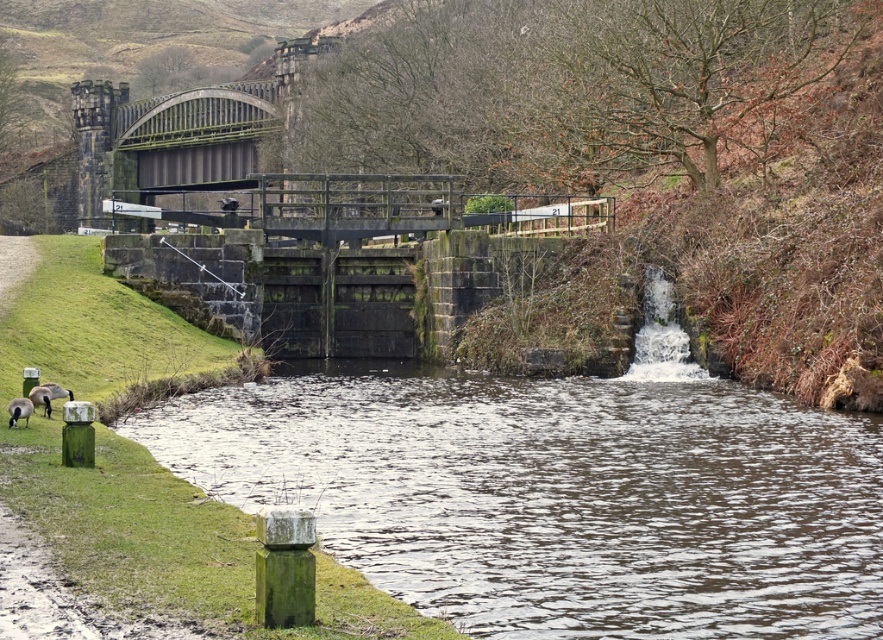
Question: Is brown/rough stone river at center positioned behind brown fuzzy duck at lower left?

Choices:
 (A) no
 (B) yes

Answer: (A)

Question: Which point is closer to the camera taking this photo?

Choices:
 (A) (411, 534)
 (B) (29, 413)

Answer: (A)

Question: Which object appears closest to the camera in this image?

Choices:
 (A) brown/rough stone river at center
 (B) brown fuzzy duck at lower left

Answer: (A)

Question: Does brown/rough stone river at center appear under brown fuzzy duck at lower left?

Choices:
 (A) no
 (B) yes

Answer: (B)

Question: Among these points, which one is nearest to the camera?

Choices:
 (A) (602, 440)
 (B) (31, 410)

Answer: (B)

Question: In this image, where is brown/rough stone river at center located relative to brown fuzzy duck at lower left?

Choices:
 (A) left
 (B) right

Answer: (B)